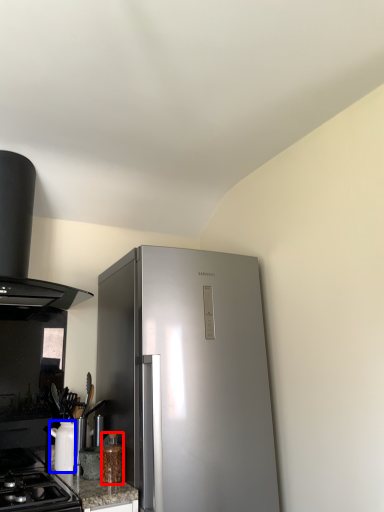
Question: Which object appears closest to the camera in this image, bottle (highlighted by a red box) or appliance (highlighted by a blue box)?

Choices:
 (A) bottle
 (B) appliance

Answer: (A)